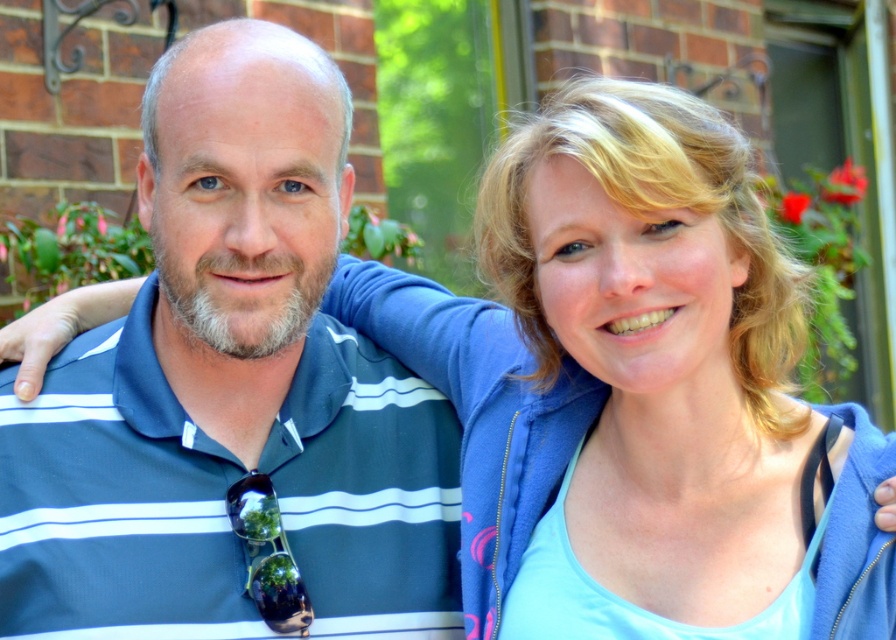
You are a photographer adjusting your camera to focus on two points in the image. The first point is at coordinates point (231, 454) and the second is at point (636, 90). Which point should you focus on first if you want to capture the closest object to the camera?

You should focus on point (231, 454) first because it is closer to the camera than point (636, 90).

You are a photographer taking a picture of the two people in the garden. You notice a point at coordinates (230,388). Which person is this point located on?

The point at coordinates (230,388) is on the blue striped polo shirt at left, so it is located on the man on the left.

You are trying to determine the spatial relationship between the blue striped polo shirt at left and the blonde hair at upper right in the image. Which object is placed higher in the image?

The blue striped polo shirt at left is positioned over blonde hair at upper right, meaning it is higher in the image.